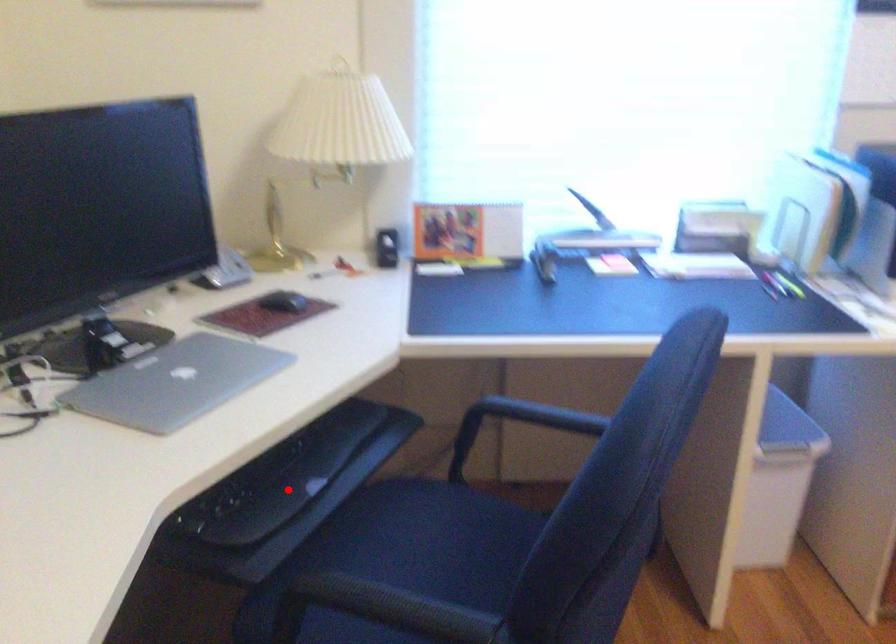
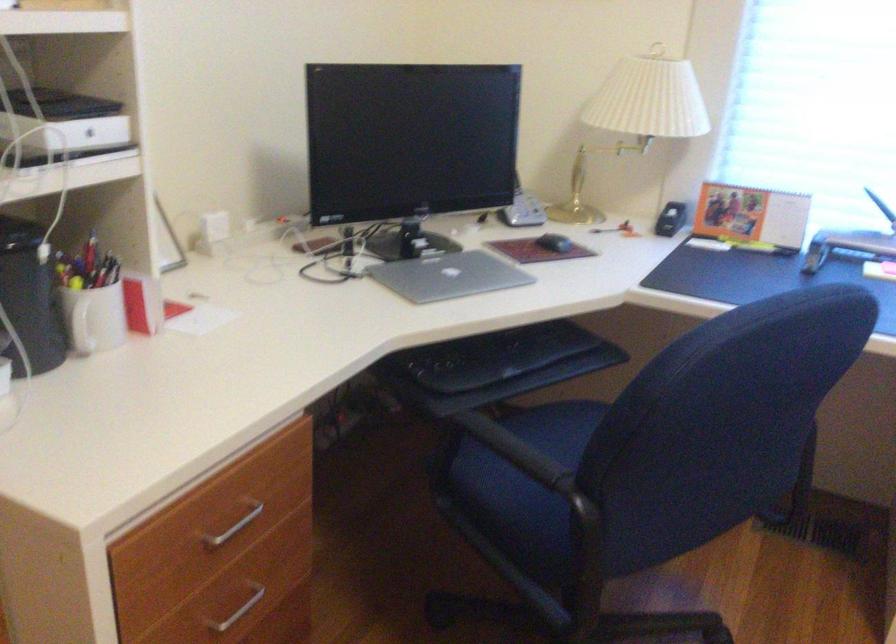
Find the pixel in the second image that matches the highlighted location in the first image.

(494, 366)